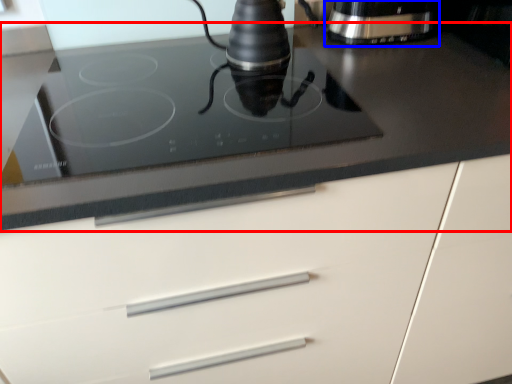
Question: Which object is closer to the camera taking this photo, countertop (highlighted by a red box) or home appliance (highlighted by a blue box)?

Choices:
 (A) countertop
 (B) home appliance

Answer: (A)